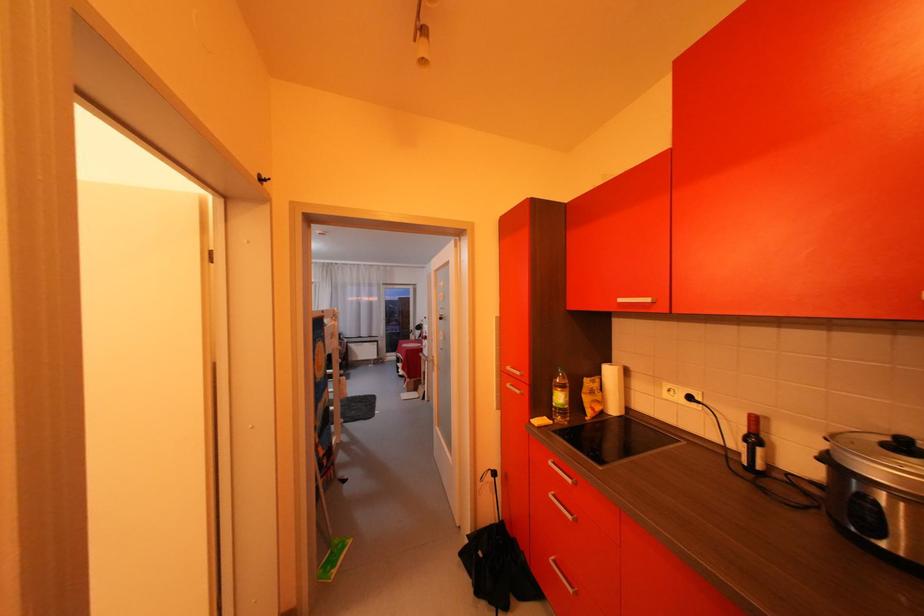
Find where to lift the dark wine bottle. Please return your answer as a coordinate pair (x, y).

(754, 446)